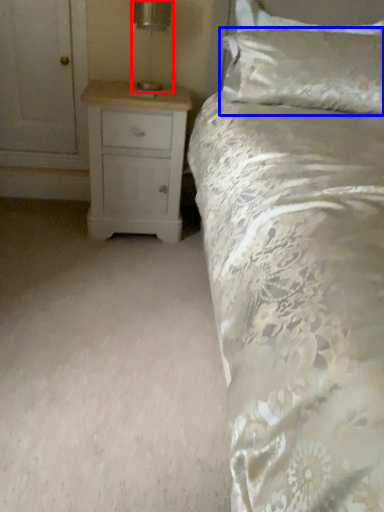
Question: Which point is further to the camera, table lamp (highlighted by a red box) or pillow (highlighted by a blue box)?

Choices:
 (A) table lamp
 (B) pillow

Answer: (B)